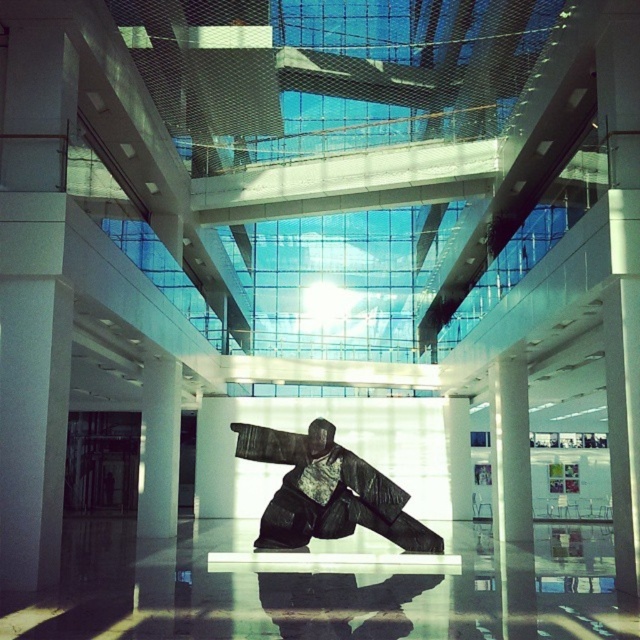
Does dark brown wood statue at center lie behind white glossy pillar at center?

Yes, dark brown wood statue at center is further from the viewer.

Who is positioned more to the left, dark brown wood statue at center or white glossy pillar at center?

Positioned to the left is dark brown wood statue at center.

Find the location of a particular element. This screenshot has height=640, width=640. dark brown wood statue at center is located at coordinates (326, 492).

The height and width of the screenshot is (640, 640). What are the coordinates of `dark brown wood statue at center` in the screenshot? It's located at (326, 492).